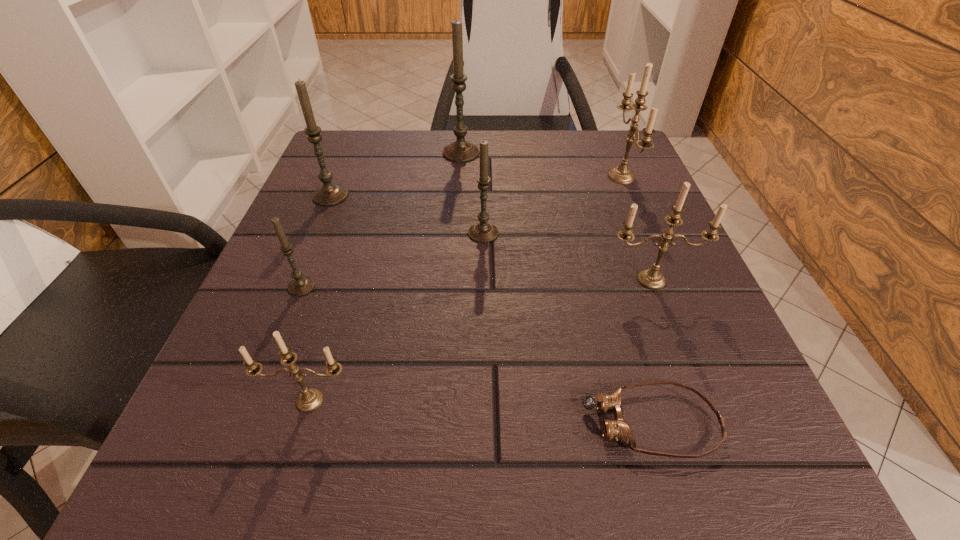
Image resolution: width=960 pixels, height=540 pixels. Identify the location of vacant space situated 0.340m on the front lenses and sides of the goggles. (300, 422).

At what (x,y) coordinates should I click in order to perform the action: click on object that is at the near edge. Please return your answer as a coordinate pair (x, y). This screenshot has height=540, width=960. Looking at the image, I should click on (618, 429).

Find the location of `goggles that is at the right edge`. goggles that is at the right edge is located at coordinates (618, 429).

Locate an element on the screen. object at the far left corner is located at coordinates (329, 194).

I want to click on object at the far right corner, so click(x=623, y=175).

Locate an element on the screen. This screenshot has width=960, height=540. object that is at the near right corner is located at coordinates (618, 429).

Find the location of a particular element. This screenshot has height=540, width=960. vacant space at the far edge of the desktop is located at coordinates (464, 186).

Identify the location of blank space at the near edge of the desktop. The width and height of the screenshot is (960, 540). (611, 445).

Locate an element on the screen. vacant space at the left edge of the desktop is located at coordinates (243, 419).

At what (x,y) coordinates should I click in order to perform the action: click on free space at the right edge. Please return your answer as a coordinate pair (x, y). Looking at the image, I should click on (612, 194).